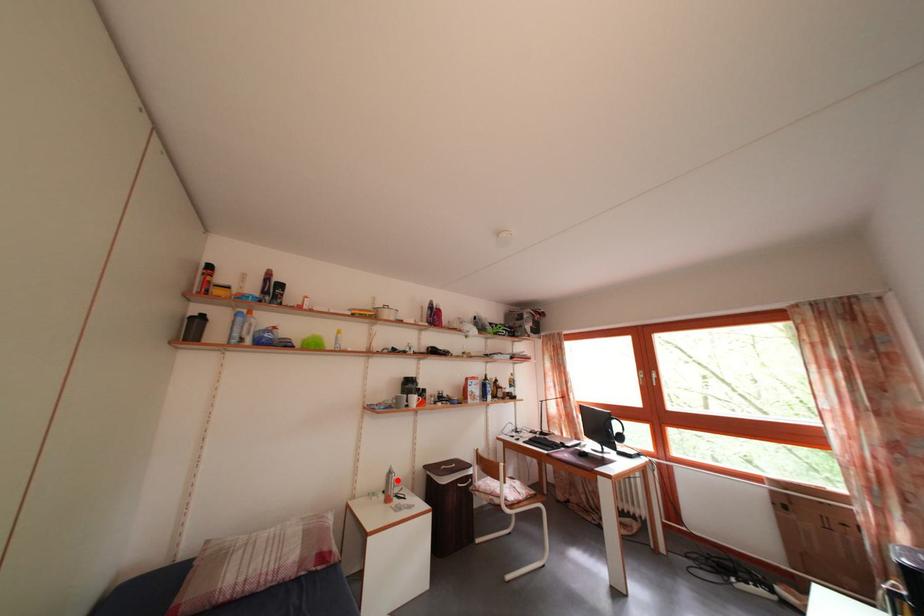
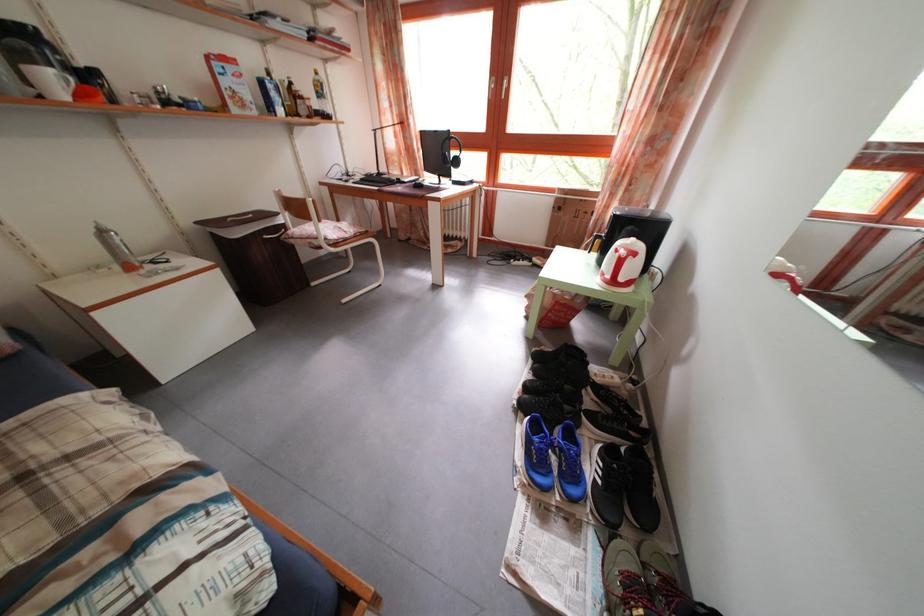
The point at the highlighted location is marked in the first image. Where is the corresponding point in the second image?

(108, 238)